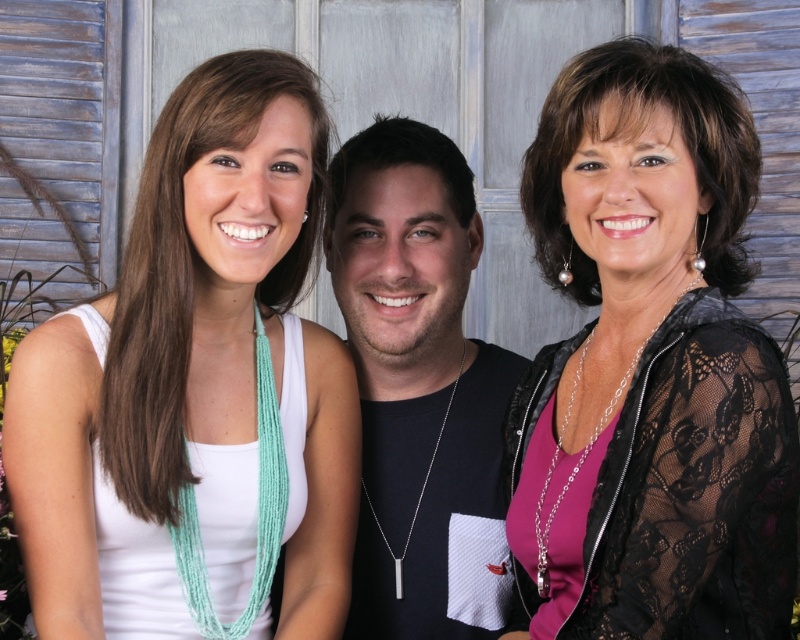
In the scene shown: You are standing in front of the image and want to describe the position of the white fabric tank top at left relative to the other objects in the scene. Based on the coordinates provided, can you determine if it is positioned to the left or right of the center of the image?

The white fabric tank top at left is located at point 0.611 on the x and 0.245 on the y. Since the x coordinate is 0.611, which is greater than 0.5, it is positioned to the right of the center of the image.